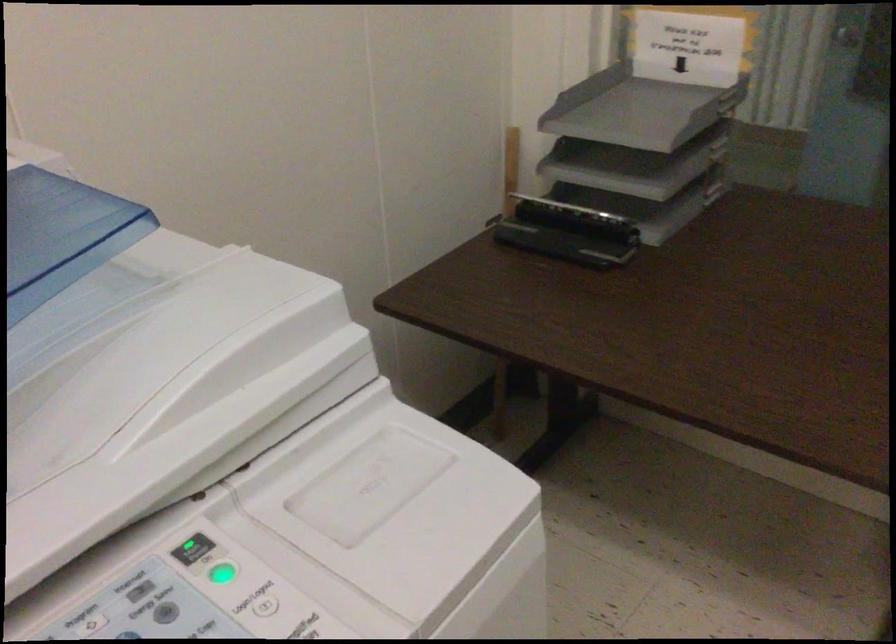
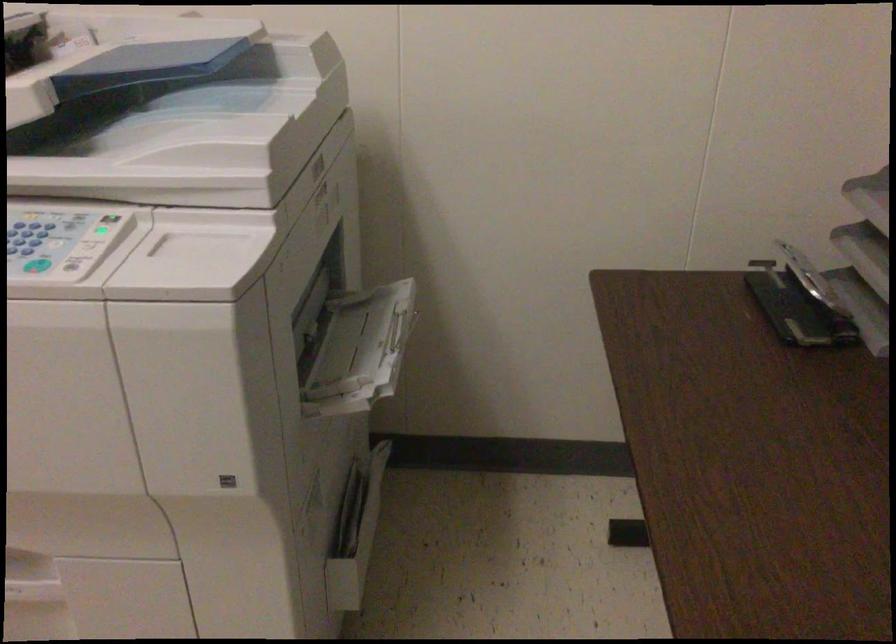
The point at [92,343] is marked in the first image. Where is the corresponding point in the second image?

(173, 126)